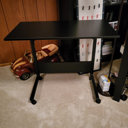
What are the coordinates of `toy car` in the screenshot? It's located at (25, 66).